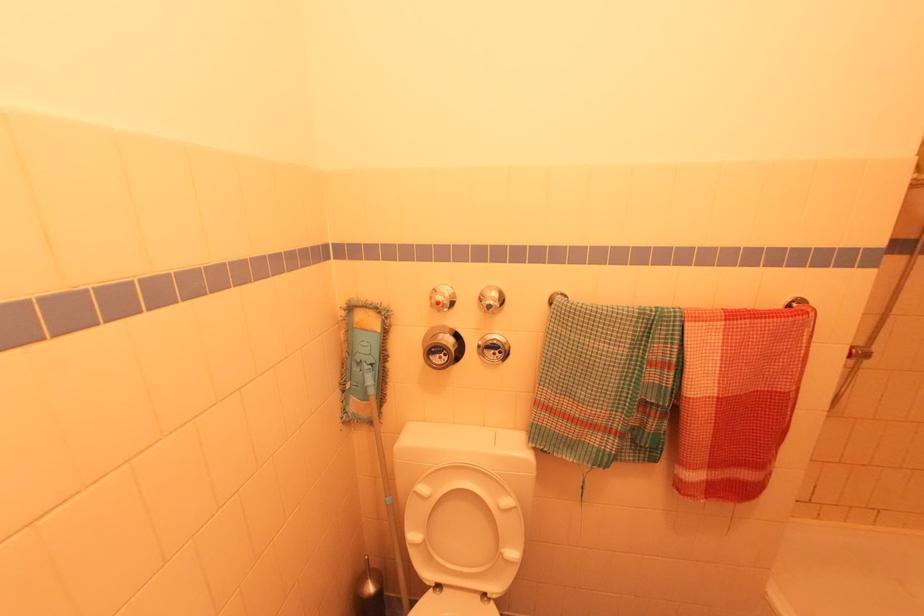
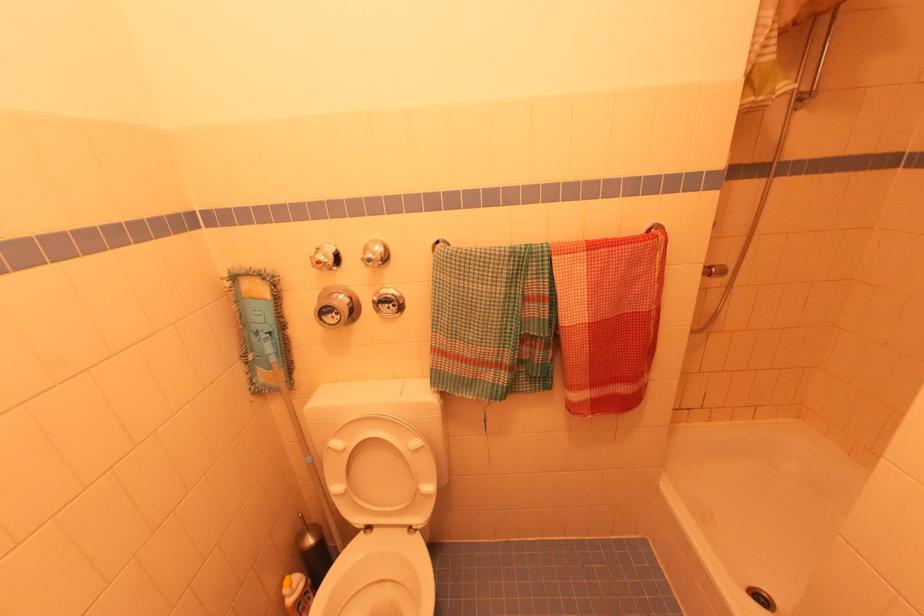
In the second image, find the point that corresponds to point (386, 395) in the first image.

(293, 361)